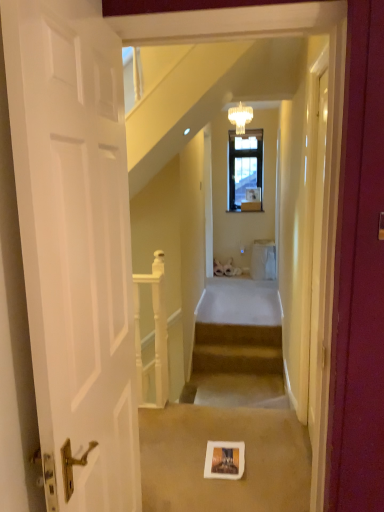
At what (x,y) coordinates should I click in order to perform the action: click on vacant area that is in front of white cardboard picture frame at center. Please return your answer as a coordinate pair (x, y). This screenshot has width=384, height=512. Looking at the image, I should click on (226, 492).